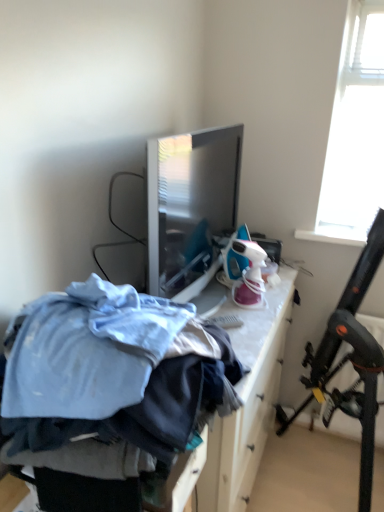
Question: Does black plastic folding chair at upper right have a lesser width compared to blue fabric pile at center?

Choices:
 (A) yes
 (B) no

Answer: (B)

Question: From the image's perspective, is black plastic folding chair at upper right beneath blue fabric pile at center?

Choices:
 (A) no
 (B) yes

Answer: (B)

Question: Is black plastic folding chair at upper right at the left side of blue fabric pile at center?

Choices:
 (A) yes
 (B) no

Answer: (B)

Question: Is black plastic folding chair at upper right taller than blue fabric pile at center?

Choices:
 (A) no
 (B) yes

Answer: (B)

Question: Is black plastic folding chair at upper right positioned in front of blue fabric pile at center?

Choices:
 (A) yes
 (B) no

Answer: (B)

Question: Is black plastic folding chair at upper right facing towards blue fabric pile at center?

Choices:
 (A) no
 (B) yes

Answer: (A)

Question: Considering the relative sizes of blue fabric pile at center and black plastic folding chair at upper right in the image provided, is blue fabric pile at center smaller than black plastic folding chair at upper right?

Choices:
 (A) yes
 (B) no

Answer: (A)

Question: Does blue fabric pile at center appear on the right side of black plastic folding chair at upper right?

Choices:
 (A) no
 (B) yes

Answer: (A)

Question: From the image's perspective, is blue fabric pile at center above black plastic folding chair at upper right?

Choices:
 (A) yes
 (B) no

Answer: (A)

Question: Is blue fabric pile at center closer to camera compared to black plastic folding chair at upper right?

Choices:
 (A) no
 (B) yes

Answer: (B)

Question: Is black plastic folding chair at upper right located within blue fabric pile at center?

Choices:
 (A) yes
 (B) no

Answer: (B)

Question: Does blue fabric pile at center have a greater height compared to black plastic folding chair at upper right?

Choices:
 (A) no
 (B) yes

Answer: (A)

Question: From the image's perspective, is blue fabric pile at center located above or below black plastic folding chair at upper right?

Choices:
 (A) below
 (B) above

Answer: (B)